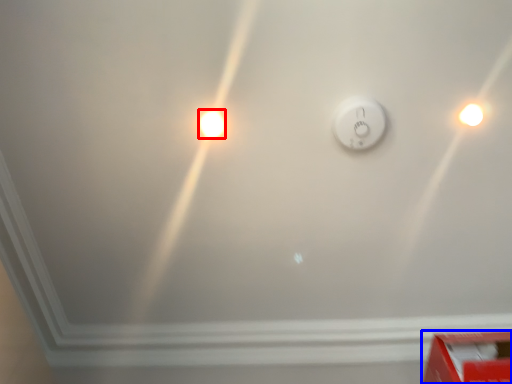
Question: Which object is further to the camera taking this photo, light bulb (highlighted by a red box) or box (highlighted by a blue box)?

Choices:
 (A) light bulb
 (B) box

Answer: (A)